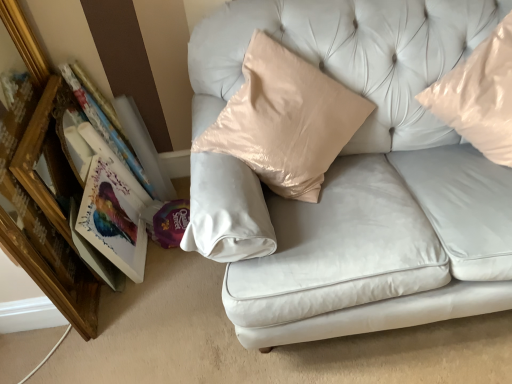
What do you see at coordinates (57, 285) in the screenshot? Image resolution: width=512 pixels, height=384 pixels. I see `wooden picture frame at left` at bounding box center [57, 285].

The image size is (512, 384). Describe the element at coordinates (356, 178) in the screenshot. I see `satin white couch at center` at that location.

Where is `satin white couch at center`? satin white couch at center is located at coordinates (356, 178).

Find the location of a particular element. Image resolution: width=512 pixels, height=384 pixels. wooden picture frame at left is located at coordinates (57, 285).

Considering the relative sizes of satin white couch at center and glossy plastic pillow at upper right in the image provided, is satin white couch at center thinner than glossy plastic pillow at upper right?

No, satin white couch at center is not thinner than glossy plastic pillow at upper right.

Does satin white couch at center have a smaller size compared to glossy plastic pillow at upper right?

Incorrect, satin white couch at center is not smaller in size than glossy plastic pillow at upper right.

From the image's perspective, would you say satin white couch at center is shown under glossy plastic pillow at upper right?

Yes.

Considering the relative positions of glossy plastic pillow at upper right and satin white couch at center in the image provided, is glossy plastic pillow at upper right to the right of satin white couch at center from the viewer's perspective?

Correct, you'll find glossy plastic pillow at upper right to the right of satin white couch at center.

From a real-world perspective, which is physically above, glossy plastic pillow at upper right or satin white couch at center?

glossy plastic pillow at upper right, from a real-world perspective.

Is glossy plastic pillow at upper right oriented towards satin white couch at center?

No.

In the scene shown: Is matte cardboard book at left positioned behind wooden picture frame at left?

Yes, matte cardboard book at left is behind wooden picture frame at left.

Is matte cardboard book at left thinner than wooden picture frame at left?

No, matte cardboard book at left is not thinner than wooden picture frame at left.

Which is closer, (132, 157) or (35, 274)?

Point (132, 157).

From a real-world perspective, is matte cardboard book at left above or below wooden picture frame at left?

In terms of real-world spatial position, matte cardboard book at left is above wooden picture frame at left.

Which of these two, matte cardboard book at left or glossy plastic pillow at upper right, stands shorter?

glossy plastic pillow at upper right is shorter.

Measure the distance between matte cardboard book at left and glossy plastic pillow at upper right.

The distance of matte cardboard book at left from glossy plastic pillow at upper right is 1.31 meters.

From a real-world perspective, which is physically below, matte cardboard book at left or glossy plastic pillow at upper right?

matte cardboard book at left.

Visually, is matte cardboard book at left positioned to the left or to the right of glossy plastic pillow at upper right?

matte cardboard book at left is positioned on glossy plastic pillow at upper right's left side.

Could you tell me if satin white couch at center is turned towards wooden picture frame at left?

No.

How many degrees apart are the facing directions of satin white couch at center and wooden picture frame at left?

satin white couch at center and wooden picture frame at left are facing 60.9 degrees away from each other.

Which is behind, point (257, 190) or point (53, 296)?

The point (53, 296) is farther from the camera.

From a real-world perspective, is satin white couch at center above or below wooden picture frame at left?

satin white couch at center is situated higher than wooden picture frame at left in the real world.

From a real-world perspective, which is physically above, glossy plastic pillow at upper right or matte cardboard book at left?

glossy plastic pillow at upper right.

I want to click on book that appears below the glossy plastic pillow at upper right (from a real-world perspective), so click(106, 127).

Are glossy plastic pillow at upper right and matte cardboard book at left beside each other?

There is a gap between glossy plastic pillow at upper right and matte cardboard book at left.

Is matte cardboard book at left at the back of glossy plastic pillow at upper right?

glossy plastic pillow at upper right does not have its back to matte cardboard book at left.

Looking at the image, does glossy plastic pillow at upper right seem bigger or smaller compared to wooden picture frame at left?

Considering their sizes, glossy plastic pillow at upper right takes up more space than wooden picture frame at left.

In the image, is glossy plastic pillow at upper right positioned in front of or behind wooden picture frame at left?

In the image, glossy plastic pillow at upper right appears in front of wooden picture frame at left.

Is wooden picture frame at left a part of glossy plastic pillow at upper right?

Definitely not — wooden picture frame at left is not inside glossy plastic pillow at upper right.

Does glossy plastic pillow at upper right turn towards wooden picture frame at left?

No.

Find the location of a particular element. pillow above the satin white couch at center (from a real-world perspective) is located at coordinates (479, 96).

Identify the location of pillow above the satin white couch at center (from the image's perspective). This screenshot has height=384, width=512. (479, 96).

Looking at the image, which one is located closer to satin white couch at center, wooden picture frame at left or matte cardboard book at left?

matte cardboard book at left lies closer to satin white couch at center than the other object.

Looking at the image, which one is located further to wooden picture frame at left, matte paper book at left or matte cardboard book at left?

Based on the image, matte cardboard book at left appears to be further to wooden picture frame at left.

Estimate the real-world distances between objects in this image. Which object is closer to glossy plastic pillow at upper right, wooden picture frame at left or matte paper book at left?

Among the two, matte paper book at left is located nearer to glossy plastic pillow at upper right.

When comparing their distances from wooden picture frame at left, does glossy plastic pillow at upper right or matte paper book at left seem closer?

Among the two, matte paper book at left is located nearer to wooden picture frame at left.

Looking at the image, which one is located further to wooden picture frame at left, matte paper book at left or satin white couch at center?

satin white couch at center lies further to wooden picture frame at left than the other object.

When comparing their distances from satin white couch at center, does matte cardboard book at left or glossy plastic pillow at upper right seem closer?

glossy plastic pillow at upper right is closer to satin white couch at center.

Considering their positions, is wooden picture frame at left positioned closer to matte cardboard book at left than satin white couch at center?

wooden picture frame at left.

Looking at the image, which one is located further to glossy plastic pillow at upper right, matte cardboard book at left or satin white couch at center?

matte cardboard book at left lies further to glossy plastic pillow at upper right than the other object.

Locate an element on the screen. This screenshot has width=512, height=384. paperback book between wooden picture frame at left and satin white couch at center from left to right is located at coordinates (113, 220).

This screenshot has width=512, height=384. In order to click on picture frame between matte cardboard book at left and matte paper book at left from top to bottom in this screenshot , I will do `click(57, 285)`.

Locate an element on the screen. paperback book located between wooden picture frame at left and glossy plastic pillow at upper right in the left-right direction is located at coordinates (113, 220).

You are a GUI agent. You are given a task and a screenshot of the screen. Output one action in this format:
    pyautogui.click(x=<x>, y=<y>)
    Task: Click on the studio couch located between matte cardboard book at left and glossy plastic pillow at upper right in the left-right direction
    This screenshot has height=384, width=512.
    Given the screenshot: What is the action you would take?
    pyautogui.click(x=356, y=178)